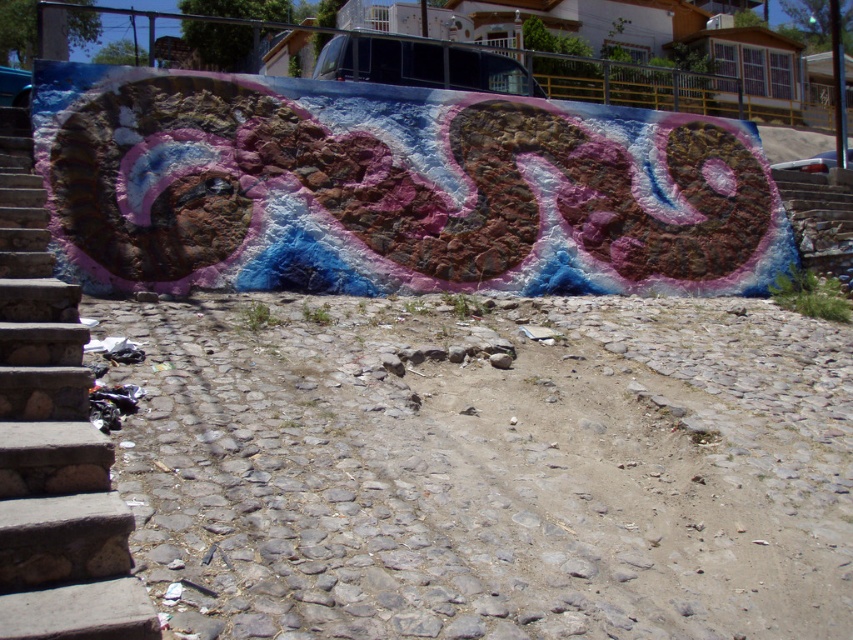
In the scene shown: Can you confirm if dirt track at lower center is positioned below stone stairs at left?

Yes, dirt track at lower center is below stone stairs at left.

Find the location of a particular element. The width and height of the screenshot is (853, 640). dirt track at lower center is located at coordinates (488, 468).